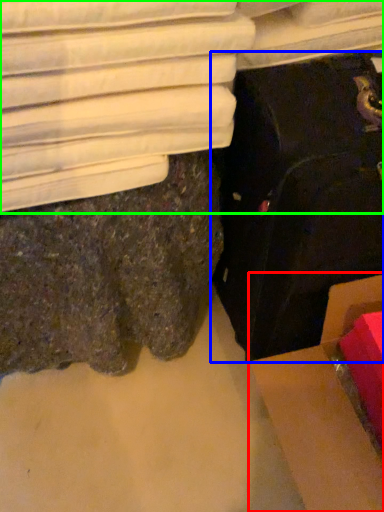
Question: Estimate the real-world distances between objects in this image. Which object is closer to cardboard box (highlighted by a red box), suitcase (highlighted by a blue box) or furniture (highlighted by a green box)?

Choices:
 (A) suitcase
 (B) furniture

Answer: (A)